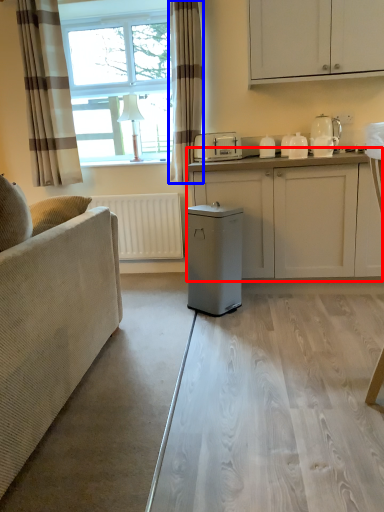
Question: Which object appears farthest to the camera in this image, cabinetry (highlighted by a red box) or curtain (highlighted by a blue box)?

Choices:
 (A) cabinetry
 (B) curtain

Answer: (B)